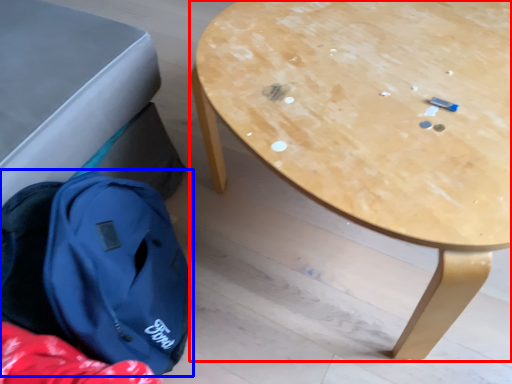
Question: Which object appears closest to the camera in this image, table (highlighted by a red box) or backpack (highlighted by a blue box)?

Choices:
 (A) table
 (B) backpack

Answer: (A)